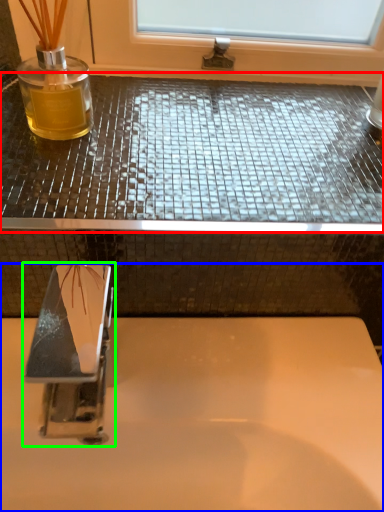
Question: Which object is positioned farthest from counter top (highlighted by a red box)? Select from sink (highlighted by a blue box) and tap (highlighted by a green box).

Choices:
 (A) sink
 (B) tap

Answer: (B)